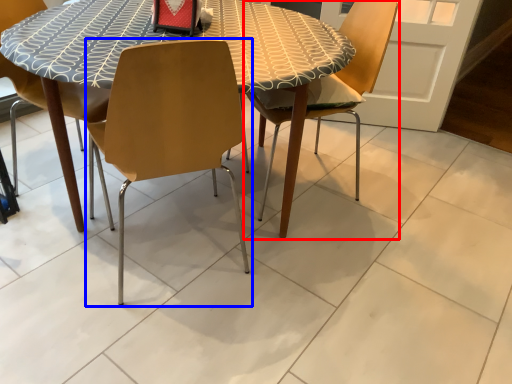
Question: Which of the following is the closest to the observer, chair (highlighted by a red box) or chair (highlighted by a blue box)?

Choices:
 (A) chair
 (B) chair

Answer: (B)